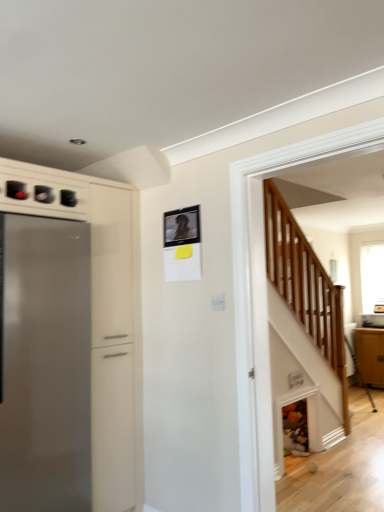
Question: Is clear glass window at upper right to the right of matte brown cabinet at right from the viewer's perspective?

Choices:
 (A) yes
 (B) no

Answer: (A)

Question: Can you confirm if clear glass window at upper right is wider than matte brown cabinet at right?

Choices:
 (A) no
 (B) yes

Answer: (A)

Question: From a real-world perspective, does clear glass window at upper right sit lower than matte brown cabinet at right?

Choices:
 (A) yes
 (B) no

Answer: (B)

Question: Is clear glass window at upper right shorter than matte brown cabinet at right?

Choices:
 (A) no
 (B) yes

Answer: (A)

Question: Is matte brown cabinet at right completely or partially inside clear glass window at upper right?

Choices:
 (A) no
 (B) yes

Answer: (A)

Question: From the image's perspective, is clear glass window at upper right located above matte brown cabinet at right?

Choices:
 (A) yes
 (B) no

Answer: (A)

Question: Does matte brown cabinet at right have a smaller size compared to satin silver refrigerator at left?

Choices:
 (A) no
 (B) yes

Answer: (B)

Question: Does matte brown cabinet at right have a larger size compared to satin silver refrigerator at left?

Choices:
 (A) no
 (B) yes

Answer: (A)

Question: Is matte brown cabinet at right further to camera compared to satin silver refrigerator at left?

Choices:
 (A) yes
 (B) no

Answer: (A)

Question: From a real-world perspective, is matte brown cabinet at right physically below satin silver refrigerator at left?

Choices:
 (A) yes
 (B) no

Answer: (A)

Question: Does matte brown cabinet at right contain satin silver refrigerator at left?

Choices:
 (A) no
 (B) yes

Answer: (A)

Question: Is the position of matte brown cabinet at right less distant than that of satin silver refrigerator at left?

Choices:
 (A) no
 (B) yes

Answer: (A)

Question: From a real-world perspective, is matte black picture frame at upper center over satin silver refrigerator at left?

Choices:
 (A) yes
 (B) no

Answer: (A)